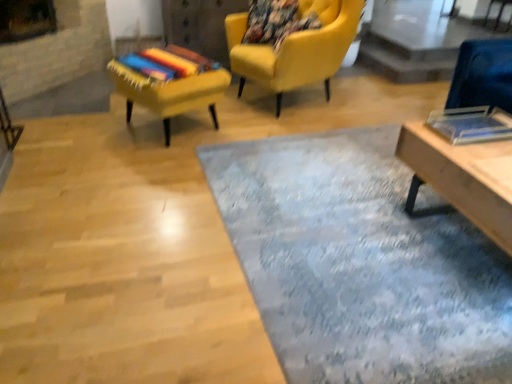
Question: Considering the relative sizes of textured yellow chair at upper left, which appears as the 2th chair when viewed from the right, and transparent glass table at upper right in the image provided, is textured yellow chair at upper left, which appears as the 2th chair when viewed from the right, taller than transparent glass table at upper right?

Choices:
 (A) no
 (B) yes

Answer: (B)

Question: From a real-world perspective, is textured yellow chair at upper left, which appears as the 2th chair when viewed from the right, on transparent glass table at upper right?

Choices:
 (A) yes
 (B) no

Answer: (A)

Question: Can you confirm if textured yellow chair at upper left, which appears as the 2th chair when viewed from the right, is positioned to the right of transparent glass table at upper right?

Choices:
 (A) no
 (B) yes

Answer: (A)

Question: Is textured yellow chair at upper left, which is the first chair from left to right, in front of transparent glass table at upper right?

Choices:
 (A) no
 (B) yes

Answer: (B)

Question: Is textured yellow chair at upper left, which is the first chair from left to right, bigger than transparent glass table at upper right?

Choices:
 (A) yes
 (B) no

Answer: (B)

Question: Based on their sizes in the image, would you say wooden table at lower right is bigger or smaller than textured blue rug at center?

Choices:
 (A) small
 (B) big

Answer: (B)

Question: In terms of height, does wooden table at lower right look taller or shorter compared to textured blue rug at center?

Choices:
 (A) tall
 (B) short

Answer: (A)

Question: Is point (423, 150) closer or farther from the camera than point (375, 299)?

Choices:
 (A) farther
 (B) closer

Answer: (A)

Question: Is wooden table at lower right wider or thinner than textured blue rug at center?

Choices:
 (A) thin
 (B) wide

Answer: (A)

Question: Would you say matte yellow armchair at upper center, acting as the 2th chair starting from the left, is to the left or to the right of textured yellow chair at upper left, which appears as the 2th chair when viewed from the right, in the picture?

Choices:
 (A) left
 (B) right

Answer: (B)

Question: In terms of width, does matte yellow armchair at upper center, acting as the 2th chair starting from the left, look wider or thinner when compared to textured yellow chair at upper left, which appears as the 2th chair when viewed from the right?

Choices:
 (A) thin
 (B) wide

Answer: (B)

Question: From their relative heights in the image, would you say matte yellow armchair at upper center, acting as the 2th chair starting from the left, is taller or shorter than textured yellow chair at upper left, which appears as the 2th chair when viewed from the right?

Choices:
 (A) short
 (B) tall

Answer: (B)

Question: From a real-world perspective, relative to textured yellow chair at upper left, which appears as the 2th chair when viewed from the right, is matte yellow armchair at upper center, acting as the 2th chair starting from the left, vertically above or below?

Choices:
 (A) above
 (B) below

Answer: (A)

Question: Is textured blue rug at center spatially inside transparent glass table at upper right, or outside of it?

Choices:
 (A) outside
 (B) inside

Answer: (A)

Question: In the image, is textured blue rug at center on the left side or the right side of transparent glass table at upper right?

Choices:
 (A) left
 (B) right

Answer: (A)